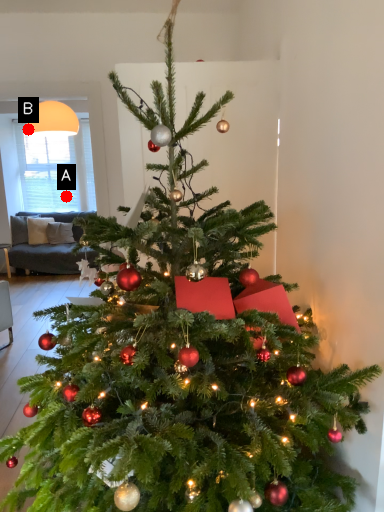
Question: Two points are circled on the image, labeled by A and B beside each circle. Which point is closer to the camera taking this photo?

Choices:
 (A) A is closer
 (B) B is closer

Answer: (B)